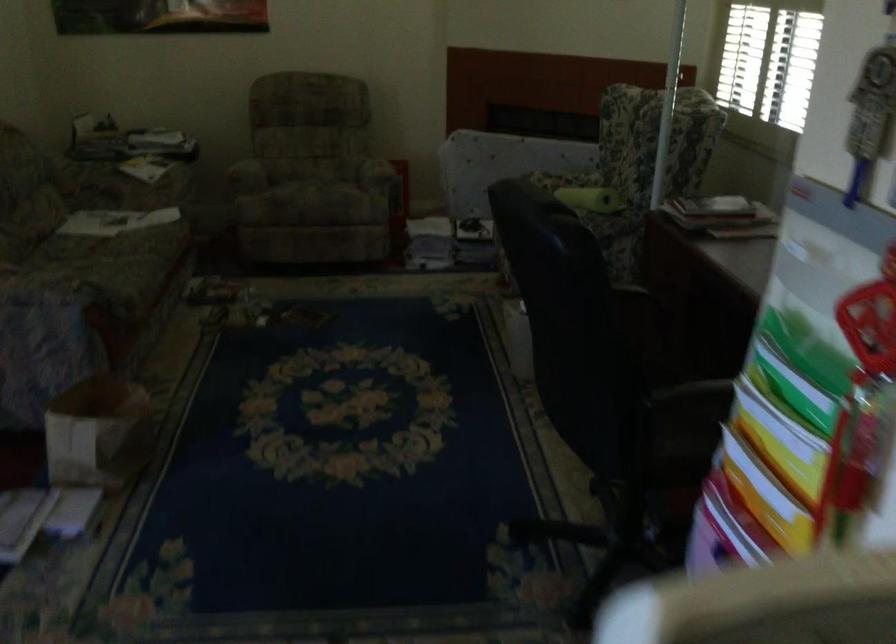
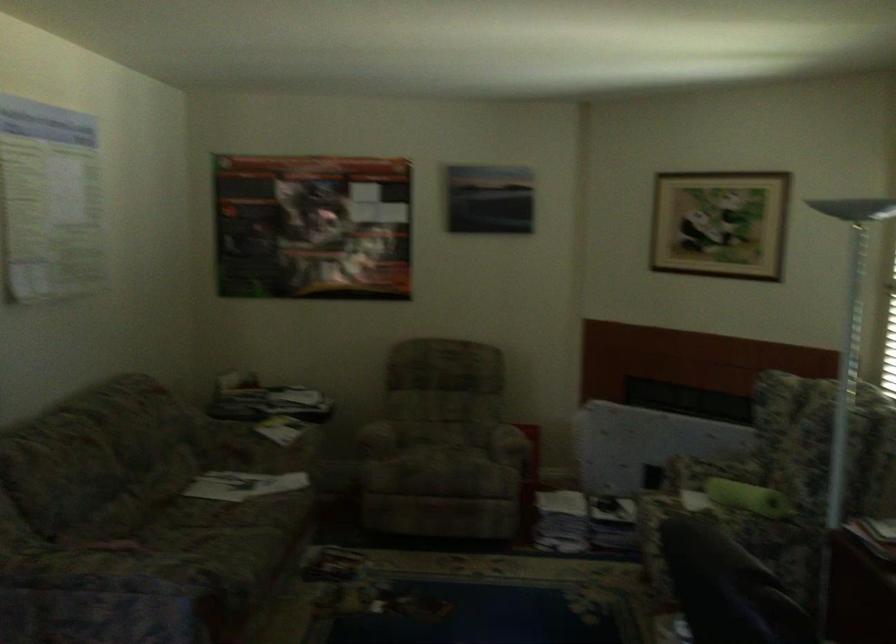
In the second image, find the point that corresponds to (x=243, y=165) in the first image.

(377, 438)